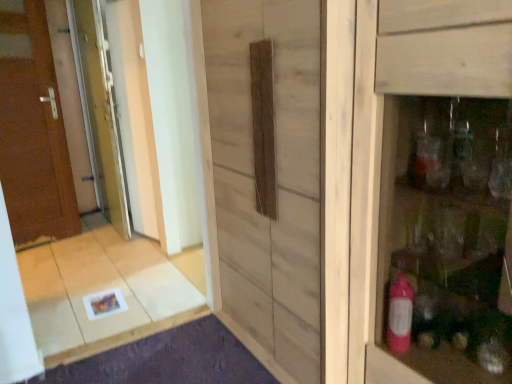
At what (x,y) coordinates should I click in order to perform the action: click on space that is in front of brown wooden door at left. Please return your answer as a coordinate pair (x, y). The height and width of the screenshot is (384, 512). Looking at the image, I should click on (37, 253).